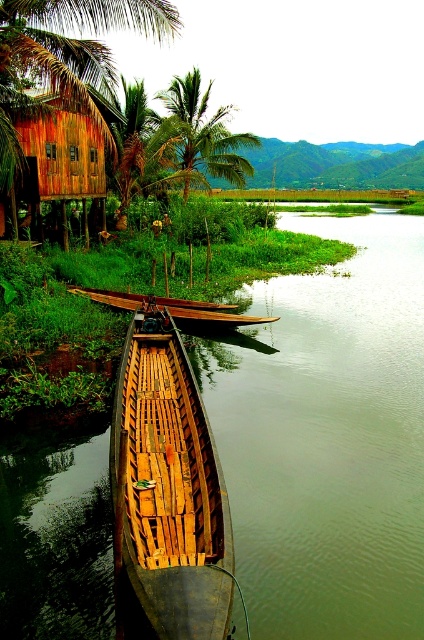
Does wooden planks boat at lower left come in front of green leafy palm tree at upper center?

Yes, wooden planks boat at lower left is closer to the viewer.

Is wooden planks boat at lower left wider than green leafy palm tree at upper center?

No.

Locate an element on the screen. wooden planks boat at lower left is located at coordinates (167, 493).

Locate an element on the screen. The height and width of the screenshot is (640, 424). brown wooden palm tree at upper left is located at coordinates (64, 58).

Is brown wooden palm tree at upper left positioned behind wooden hut at upper left?

No, it is in front of wooden hut at upper left.

Measure the distance between brown wooden palm tree at upper left and camera.

The distance of brown wooden palm tree at upper left from camera is 13.41 meters.

Find the location of `brown wooden palm tree at upper left`. brown wooden palm tree at upper left is located at coordinates (64, 58).

Is greenish-brown wooden boat at lower center bigger than brown wooden palm tree at upper left?

Yes, greenish-brown wooden boat at lower center is bigger than brown wooden palm tree at upper left.

Looking at this image, between greenish-brown wooden boat at lower center and brown wooden palm tree at upper left, which one is positioned lower?

greenish-brown wooden boat at lower center is below.

I want to click on greenish-brown wooden boat at lower center, so click(x=328, y=436).

Find the location of a particular element. This screenshot has height=640, width=424. greenish-brown wooden boat at lower center is located at coordinates (328, 436).